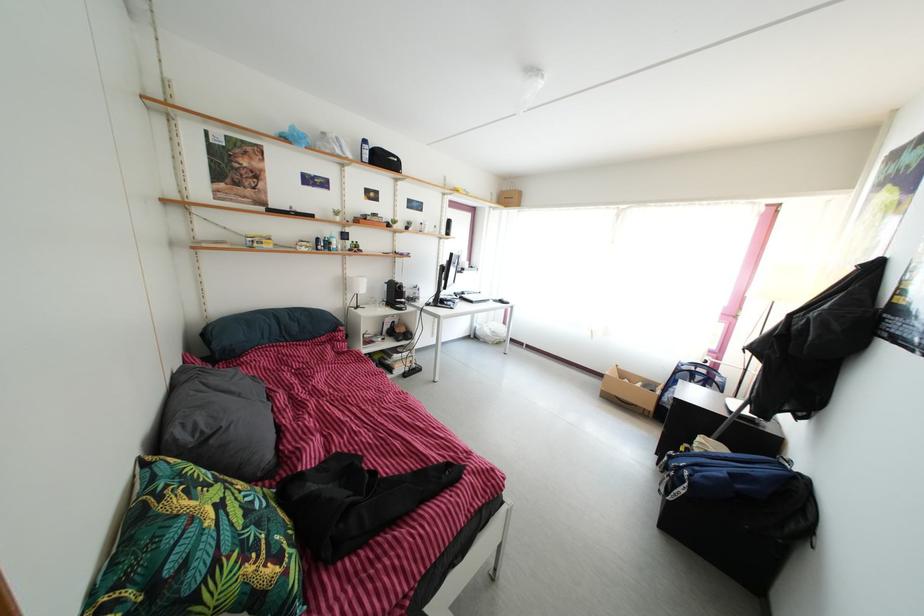
The location [363,150] corresponds to which object?

This point indicates the blue spray bottle.